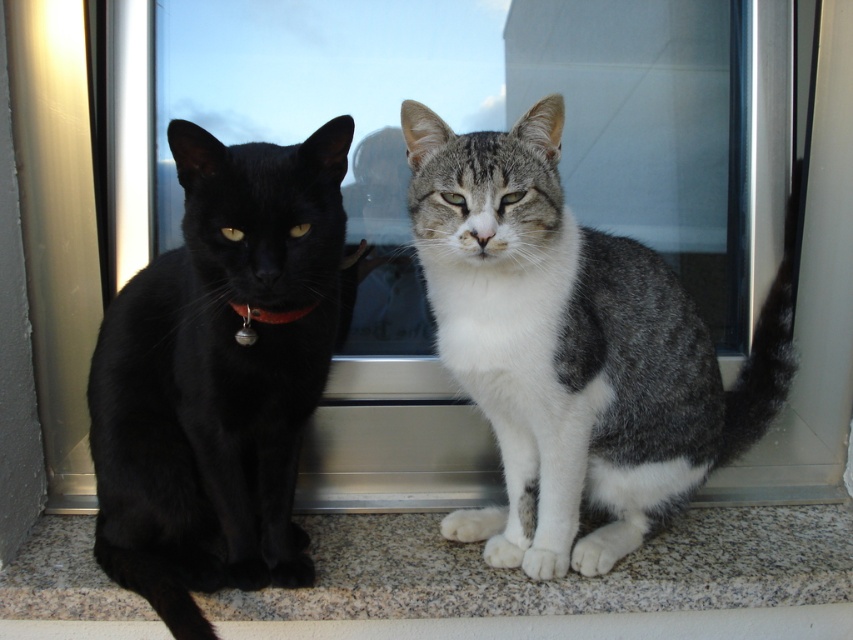
Consider the image. Can you confirm if gray-white fur cat at center is positioned to the left of red leather collar at center?

Incorrect, gray-white fur cat at center is not on the left side of red leather collar at center.

Describe the element at coordinates (573, 348) in the screenshot. I see `gray-white fur cat at center` at that location.

You are a GUI agent. You are given a task and a screenshot of the screen. Output one action in this format:
    pyautogui.click(x=<x>, y=<y>)
    Task: Click on the gray-white fur cat at center
    The width and height of the screenshot is (853, 640).
    Given the screenshot: What is the action you would take?
    pyautogui.click(x=573, y=348)

Does granite at lower center appear on the left side of red leather collar at center?

In fact, granite at lower center is to the right of red leather collar at center.

Does granite at lower center have a lesser width compared to red leather collar at center?

No.

What do you see at coordinates (566, 573) in the screenshot? The width and height of the screenshot is (853, 640). I see `granite at lower center` at bounding box center [566, 573].

Locate an element on the screen. The height and width of the screenshot is (640, 853). granite at lower center is located at coordinates (566, 573).

Between matte black cat at left and red leather collar at center, which one is positioned higher?

red leather collar at center is above.

Is matte black cat at left positioned before red leather collar at center?

Yes, matte black cat at left is in front of red leather collar at center.

Is point (177, 278) more distant than point (244, 314)?

Yes.

Locate an element on the screen. matte black cat at left is located at coordinates (218, 376).